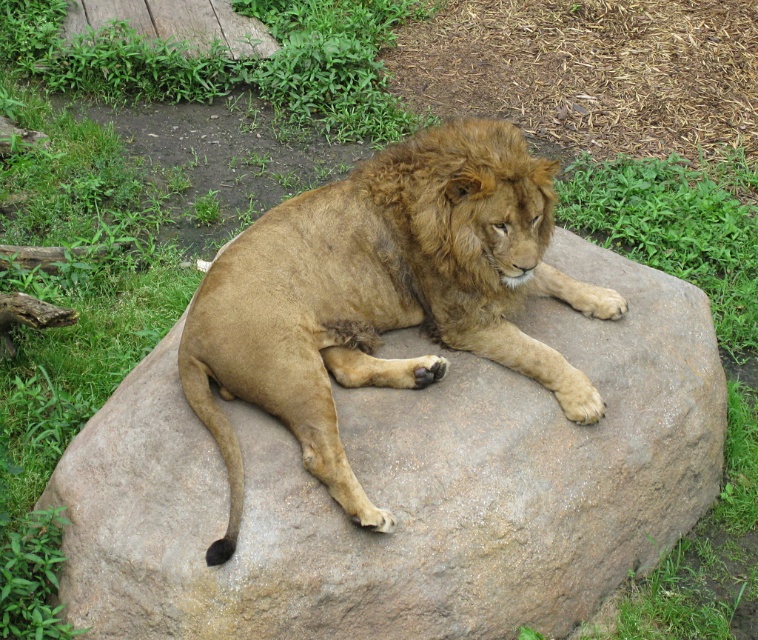
You are a wildlife photographer trying to capture the golden fur lion at center and the brown fuzzy mane at center in a single frame. Based on their sizes, which one should you focus on to ensure both fit in the photo without cropping?

The golden fur lion at center is much taller than the brown fuzzy mane at center, so focusing on the golden fur lion at center will ensure both fit in the photo without cropping.

You are a zookeeper observing the lion in its enclosure. You notice the golden fur lion at center and the brown fuzzy mane at center. Which object is located above the other?

The brown fuzzy mane at center is above the golden fur lion at center because the golden fur lion at center is positioned under brown fuzzy mane at center.

You are a zookeeper trying to determine if a new feeding tray will fit between the golden fur lion at center and the brown fuzzy mane at center. The tray requires 1 meter of space. Can you confirm if there is enough space?

The golden fur lion at center might be wider than brown fuzzy mane at center, so the space between them may not be sufficient for the feeding tray requiring 1 meter of space. Please check the actual dimensions before placing the tray.